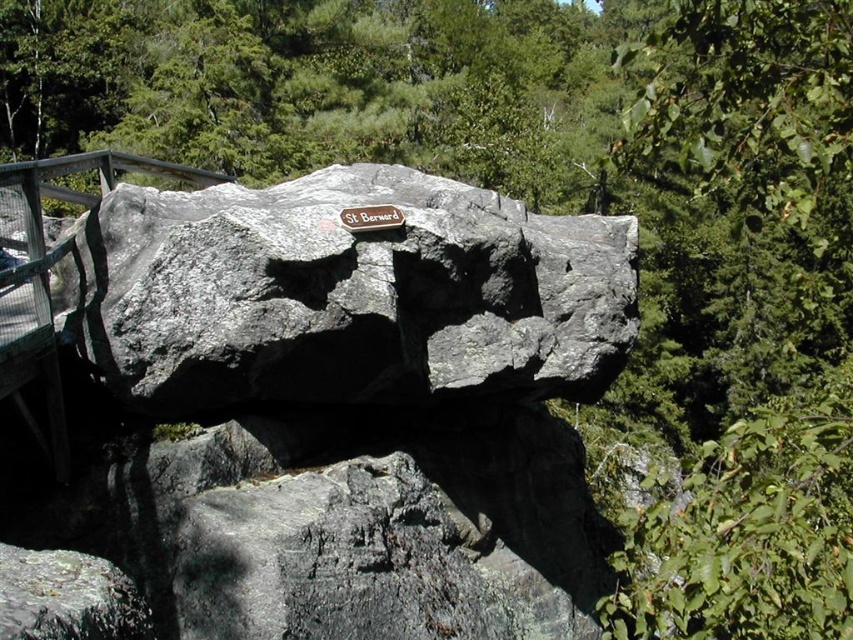
You are a hiker who wants to read the text on the metallic plaque at center. The gray rough rock at center is blocking your view. Can you move around the rock to see the plaque clearly?

The gray rough rock at center is in front of the metallic plaque at center, so moving around the rock should allow you to see the plaque clearly.